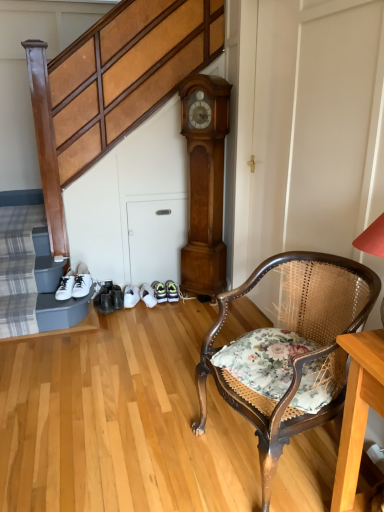
Image resolution: width=384 pixels, height=512 pixels. Describe the element at coordinates (105, 286) in the screenshot. I see `shiny black shoe at lower center` at that location.

Identify the location of floral fabric cushion at lower right. Image resolution: width=384 pixels, height=512 pixels. (264, 360).

In the scene shown: Is white leather sneakers at lower left facing towards light brown wood clock at center?

No, white leather sneakers at lower left is not oriented towards light brown wood clock at center.

From a real-world perspective, which object rests below the other?

white leather sneakers at lower left is physically lower.

Considering the positions of points (89, 285) and (189, 80), is point (89, 285) closer to camera compared to point (189, 80)?

No, (89, 285) is behind (189, 80).

Considering their positions, is white leather sneakers at lower left located in front of or behind light brown wood clock at center?

white leather sneakers at lower left is positioned farther from the viewer than light brown wood clock at center.

Which of these two, white leather sneakers at lower left or floral fabric cushion at lower right, is thinner?

With smaller width is white leather sneakers at lower left.

Is white leather sneakers at lower left at the left side of floral fabric cushion at lower right?

Correct, you'll find white leather sneakers at lower left to the left of floral fabric cushion at lower right.

Which of these two, white leather sneakers at lower left or floral fabric cushion at lower right, is smaller?

white leather sneakers at lower left.

Which object is further away from the camera, floral fabric cushion at lower right or shiny black shoe at lower center?

shiny black shoe at lower center is behind.

Is floral fabric cushion at lower right at the right side of shiny black shoe at lower center?

Yes, floral fabric cushion at lower right is to the right of shiny black shoe at lower center.

Is floral fabric cushion at lower right oriented away from shiny black shoe at lower center?

No, floral fabric cushion at lower right is not facing away from shiny black shoe at lower center.

Is shiny black shoe at lower center completely or partially inside floral fabric cushion at lower right?

Definitely not — shiny black shoe at lower center is not inside floral fabric cushion at lower right.

Which is more to the right, floral fabric chair at lower right or white leather sneakers at lower left?

Positioned to the right is floral fabric chair at lower right.

From a real-world perspective, is floral fabric chair at lower right above or below white leather sneakers at lower left?

Clearly, from a real-world perspective, floral fabric chair at lower right is above white leather sneakers at lower left.

Looking at this image, is floral fabric chair at lower right surrounding white leather sneakers at lower left?

No, white leather sneakers at lower left is not a part of floral fabric chair at lower right.

This screenshot has width=384, height=512. I want to click on footwear lying on the left of light brown wood clock at center, so click(74, 283).

Considering their positions, is light brown wood clock at center located in front of or behind white leather sneakers at lower left?

light brown wood clock at center is in front of white leather sneakers at lower left.

Which point is more forward, (202, 110) or (86, 282)?

The point (202, 110) is in front.

Which of these two, light brown wood clock at center or white leather sneakers at lower left, stands shorter?

white leather sneakers at lower left is shorter.

Between white leather sneakers at lower left and floral fabric chair at lower right, which one is positioned behind?

white leather sneakers at lower left is behind.

Which object is positioned more to the left, white leather sneakers at lower left or floral fabric chair at lower right?

white leather sneakers at lower left is more to the left.

Is white leather sneakers at lower left positioned beyond the bounds of floral fabric chair at lower right?

white leather sneakers at lower left is positioned outside floral fabric chair at lower right.

Measure the distance from white leather sneakers at lower left to floral fabric chair at lower right.

white leather sneakers at lower left and floral fabric chair at lower right are 1.55 meters apart from each other.

Is shiny black shoe at lower center located outside floral fabric chair at lower right?

Yes, shiny black shoe at lower center is outside of floral fabric chair at lower right.

Are shiny black shoe at lower center and floral fabric chair at lower right making contact?

shiny black shoe at lower center is not next to floral fabric chair at lower right, and they're not touching.

Which object is closer to the camera taking this photo, shiny black shoe at lower center or floral fabric chair at lower right?

floral fabric chair at lower right.

Between shiny black shoe at lower center and floral fabric chair at lower right, which one appears on the right side from the viewer's perspective?

Positioned to the right is floral fabric chair at lower right.

The width and height of the screenshot is (384, 512). I want to click on footwear behind the light brown wood clock at center, so click(74, 283).

You are a GUI agent. You are given a task and a screenshot of the screen. Output one action in this format:
    pyautogui.click(x=<x>, y=<y>)
    Task: Click on the pillow that is above the white leather sneakers at lower left (from a real-world perspective)
    The image size is (384, 512).
    Given the screenshot: What is the action you would take?
    pyautogui.click(x=264, y=360)

Which object lies further to the anchor point floral fabric chair at lower right, white leather sneakers at lower left or floral fabric cushion at lower right?

white leather sneakers at lower left lies further to floral fabric chair at lower right than the other object.

Based on the photo, estimate the real-world distances between objects in this image. Which object is closer to floral fabric cushion at lower right, floral fabric chair at lower right or light brown wood clock at center?

floral fabric chair at lower right is positioned closer to the anchor floral fabric cushion at lower right.

Looking at the image, which one is located closer to shiny black shoe at lower center, floral fabric chair at lower right or light brown wood clock at center?

light brown wood clock at center lies closer to shiny black shoe at lower center than the other object.

Which object lies further to the anchor point white leather sneakers at lower left, floral fabric cushion at lower right or light brown wood clock at center?

Based on the image, floral fabric cushion at lower right appears to be further to white leather sneakers at lower left.

Based on their spatial positions, is light brown wood clock at center or shiny black shoe at lower center closer to white leather sneakers at lower left?

shiny black shoe at lower center is positioned closer to the anchor white leather sneakers at lower left.

Estimate the real-world distances between objects in this image. Which object is closer to white leather sneakers at lower left, floral fabric chair at lower right or shiny black shoe at lower center?

Among the two, shiny black shoe at lower center is located nearer to white leather sneakers at lower left.

From the image, which object appears to be nearer to shiny black shoe at lower center, floral fabric cushion at lower right or floral fabric chair at lower right?

Among the two, floral fabric cushion at lower right is located nearer to shiny black shoe at lower center.

When comparing their distances from shiny black shoe at lower center, does floral fabric chair at lower right or floral fabric cushion at lower right seem further?

The object further to shiny black shoe at lower center is floral fabric chair at lower right.

Find the location of a particular element. The height and width of the screenshot is (512, 384). pillow positioned between floral fabric chair at lower right and white leather sneakers at lower left from near to far is located at coordinates [x=264, y=360].

You are a GUI agent. You are given a task and a screenshot of the screen. Output one action in this format:
    pyautogui.click(x=<x>, y=<y>)
    Task: Click on the shoe situated between white leather sneakers at lower left and light brown wood clock at center from left to right
    
    Given the screenshot: What is the action you would take?
    pyautogui.click(x=105, y=286)

The height and width of the screenshot is (512, 384). Identify the location of footwear located between floral fabric chair at lower right and shiny black shoe at lower center in the depth direction. (74, 283).

Where is `pillow between floral fabric chair at lower right and shiny black shoe at lower center in the front-back direction`? pillow between floral fabric chair at lower right and shiny black shoe at lower center in the front-back direction is located at coordinates (264, 360).